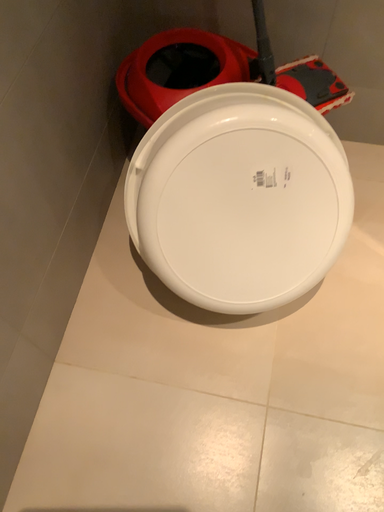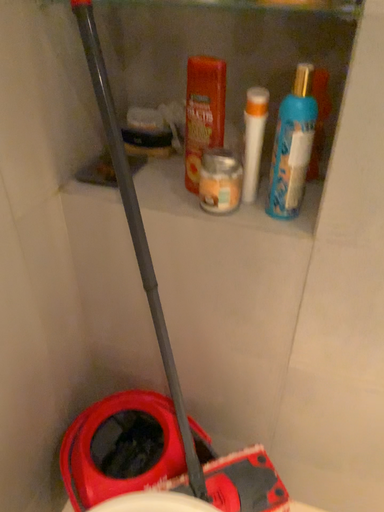
Question: Which way did the camera rotate in the video?

Choices:
 (A) rotated downward
 (B) rotated upward

Answer: (B)